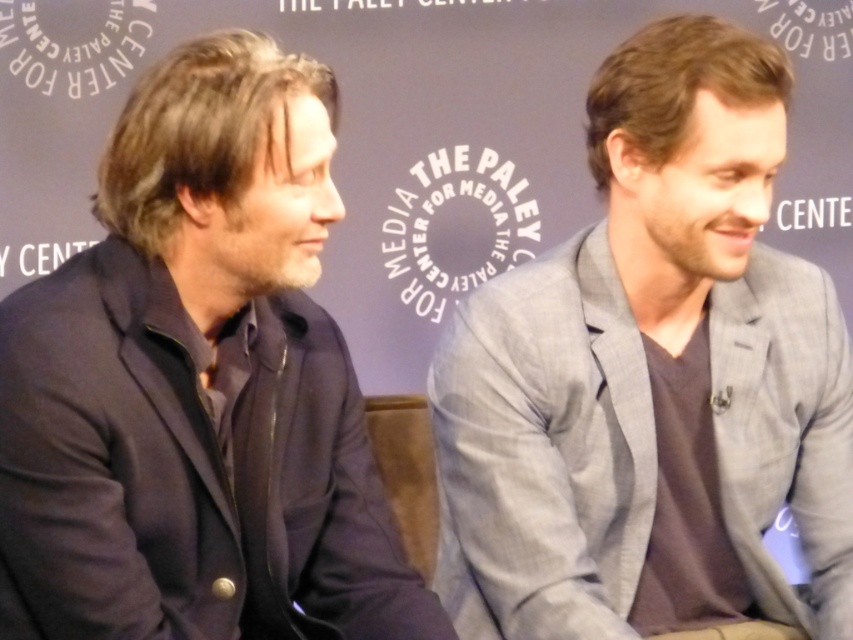
Question: Can you confirm if gray textured blazer at center is bigger than dark blue suit at left?

Choices:
 (A) no
 (B) yes

Answer: (B)

Question: Which point is farther to the camera?

Choices:
 (A) dark blue suit at left
 (B) gray textured blazer at center

Answer: (B)

Question: Does gray textured blazer at center appear on the right side of dark blue suit at left?

Choices:
 (A) yes
 (B) no

Answer: (A)

Question: Does gray textured blazer at center have a larger size compared to dark blue suit at left?

Choices:
 (A) no
 (B) yes

Answer: (B)

Question: Which of the following is the closest to the observer?

Choices:
 (A) gray textured blazer at center
 (B) dark blue suit at left

Answer: (B)

Question: Which object is farther from the camera taking this photo?

Choices:
 (A) dark blue suit at left
 (B) gray textured blazer at center

Answer: (B)